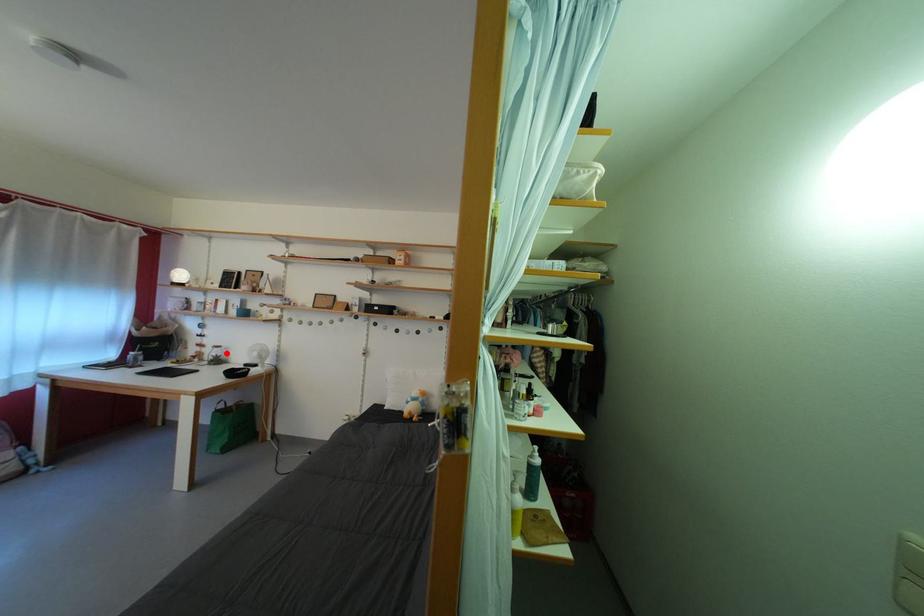
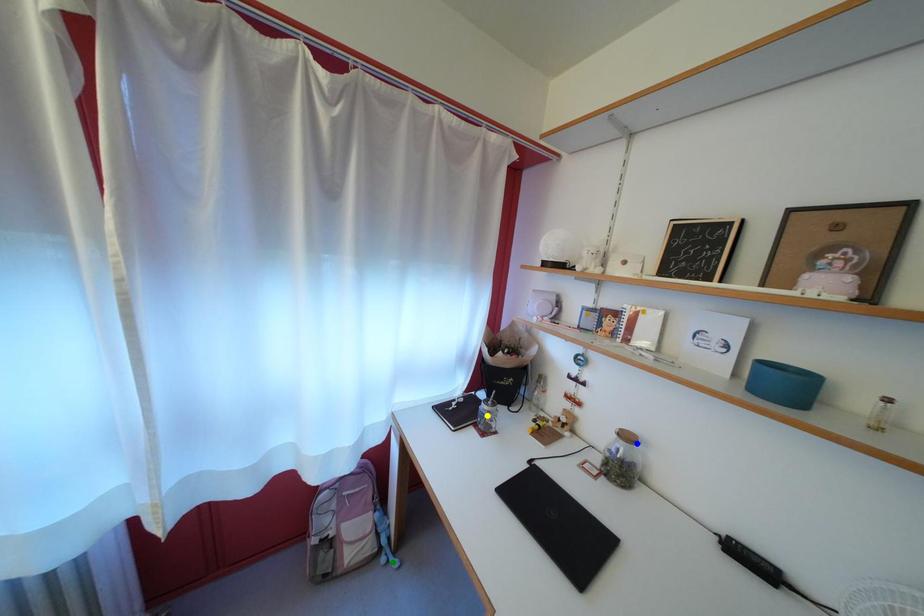
Question: I am providing you with two images of the same scene from different viewpoints. A red point is marked on the first image. You are given multiple points on the second image. Which spot in image 2 lines up with the point in image 1?

Choices:
 (A) yellow point
 (B) green point
 (C) blue point

Answer: (C)